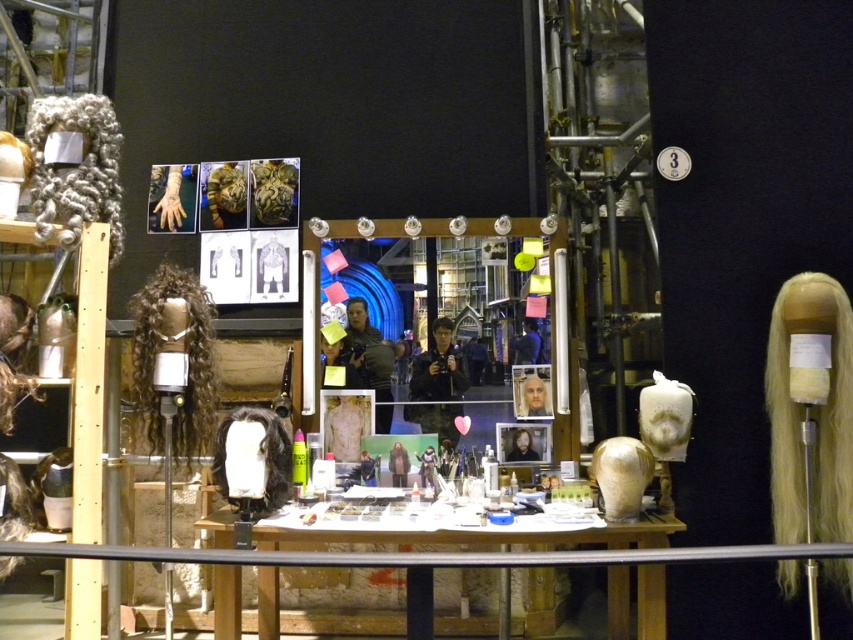
Question: Which of the following is the farthest from the observer?

Choices:
 (A) black matte wig at center
 (B) wooden table at center

Answer: (A)

Question: Can you confirm if wooden table at center is bigger than curly brown wig at center?

Choices:
 (A) no
 (B) yes

Answer: (B)

Question: Among these points, which one is nearest to the camera?

Choices:
 (A) (659, 634)
 (B) (260, 493)
 (C) (192, 304)

Answer: (A)

Question: Can you confirm if blonde synthetic wig at right is positioned above curly brown wig at center?

Choices:
 (A) no
 (B) yes

Answer: (A)

Question: Which point is closer to the camera taking this photo?

Choices:
 (A) (277, 573)
 (B) (171, 358)

Answer: (B)

Question: Observing the image, what is the correct spatial positioning of blonde synthetic wig at right in reference to black matte wig at center?

Choices:
 (A) right
 (B) left

Answer: (A)